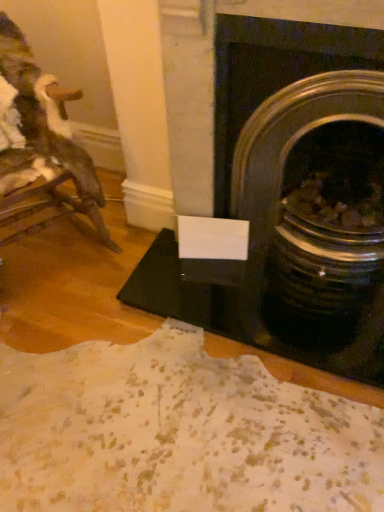
Question: Is wooden rocking chair at left spatially inside black glossy fireplace at center right, or outside of it?

Choices:
 (A) inside
 (B) outside

Answer: (B)

Question: Does point (56, 166) appear closer or farther from the camera than point (296, 5)?

Choices:
 (A) farther
 (B) closer

Answer: (A)

Question: In terms of width, does wooden rocking chair at left look wider or thinner when compared to black glossy fireplace at center right?

Choices:
 (A) wide
 (B) thin

Answer: (A)

Question: Does point (349, 12) appear closer or farther from the camera than point (6, 192)?

Choices:
 (A) closer
 (B) farther

Answer: (A)

Question: Looking at the image, does black glossy fireplace at center right seem bigger or smaller compared to wooden rocking chair at left?

Choices:
 (A) big
 (B) small

Answer: (B)

Question: Is black glossy fireplace at center right in front of or behind wooden rocking chair at left in the image?

Choices:
 (A) front
 (B) behind

Answer: (B)

Question: Is black glossy fireplace at center right to the left or to the right of wooden rocking chair at left in the image?

Choices:
 (A) right
 (B) left

Answer: (A)